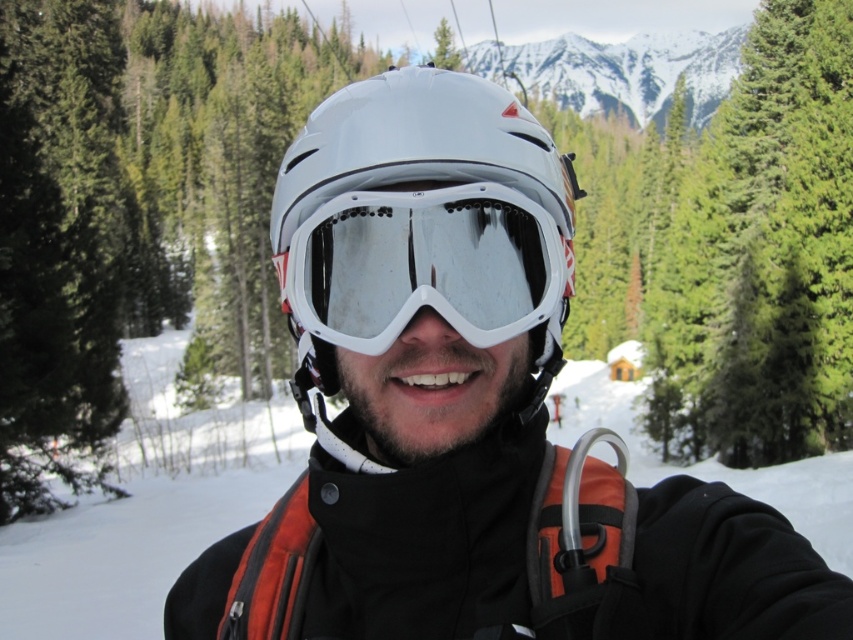
You are standing in a snowy mountain area and see the white matte helmet at center. If you want to reach the helmet, how many steps do you estimate you need to take, assuming each step covers 3 feet?

The distance between you and the white matte helmet at center is 9.91 feet. Since each step covers 3 feet, you would need approximately 3 steps to reach it.

What are the coordinates of the white matte helmet at center?

The white matte helmet at center is located at point [419,228].